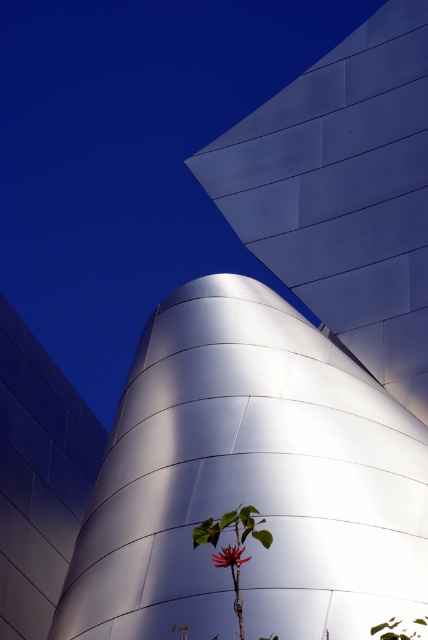
Question: Does green leafy plant at lower center have a smaller size compared to bright red flower at center?

Choices:
 (A) yes
 (B) no

Answer: (B)

Question: Which of the following is the closest to the observer?

Choices:
 (A) bright red flower at center
 (B) green leafy plant at lower center

Answer: (B)

Question: Is green leafy plant at lower center smaller than bright red flower at center?

Choices:
 (A) yes
 (B) no

Answer: (B)

Question: Does green leafy plant at lower center appear on the right side of bright red flower at center?

Choices:
 (A) yes
 (B) no

Answer: (B)